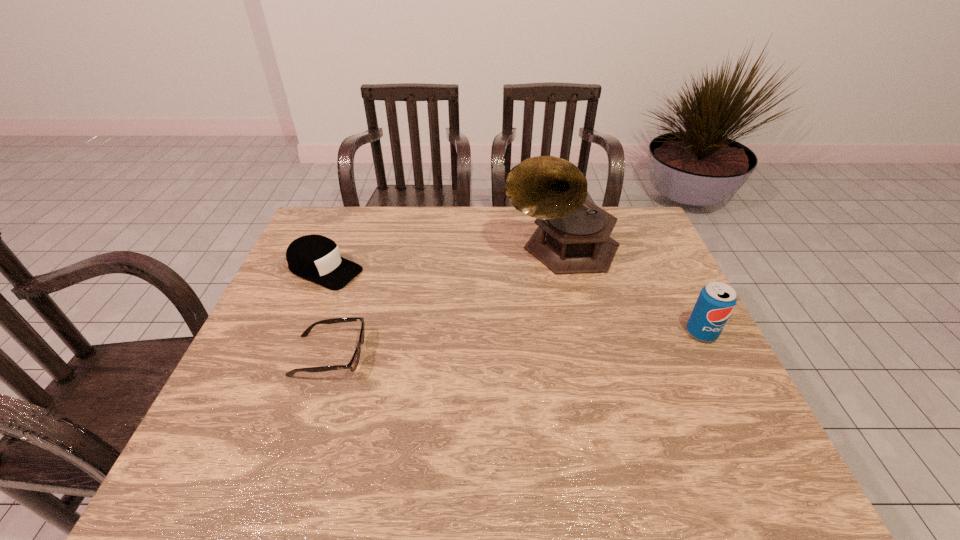
Find the location of a particular element. The width and height of the screenshot is (960, 540). blank space that satisfies the following two spatial constraints: 1. on the front side of the second shortest object; 2. on the lenses of the spectacles is located at coordinates (289, 355).

This screenshot has height=540, width=960. Identify the location of free space that satisfies the following two spatial constraints: 1. on the front side of the shortest object; 2. on the lenses of the second shortest object. point(289,355).

Where is `free point that satisfies the following two spatial constraints: 1. on the back side of the cap; 2. on the left side of the phonograph record`? free point that satisfies the following two spatial constraints: 1. on the back side of the cap; 2. on the left side of the phonograph record is located at coordinates [334, 247].

Where is `vacant space that satisfies the following two spatial constraints: 1. on the front side of the second tallest object; 2. on the left side of the phonograph record`? vacant space that satisfies the following two spatial constraints: 1. on the front side of the second tallest object; 2. on the left side of the phonograph record is located at coordinates (581, 333).